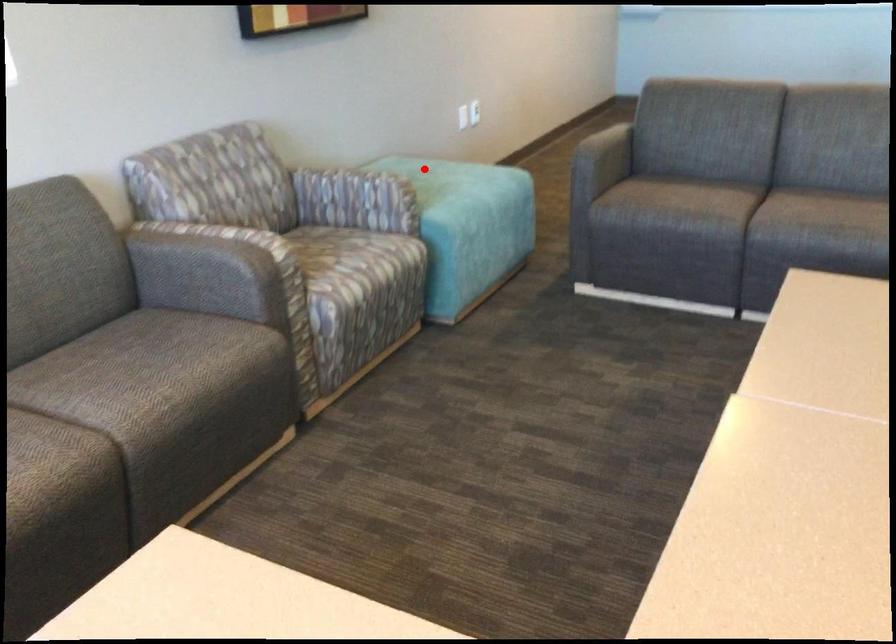
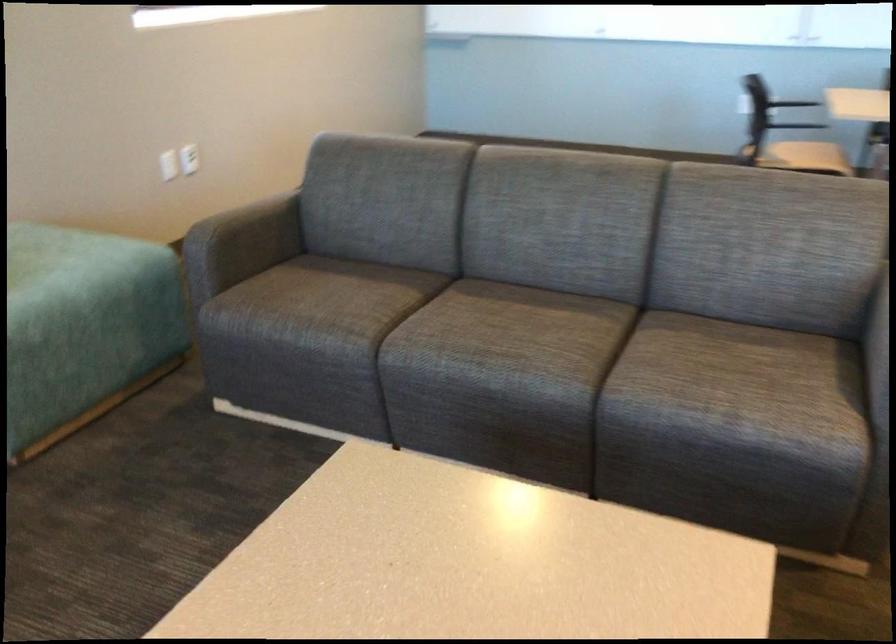
Question: I am providing you with two images of the same scene from different viewpoints. Given a red point in image1, look at the same physical point in image2. Is it:

Choices:
 (A) Closer to the viewpoint
 (B) Farther from the viewpoint

Answer: (A)